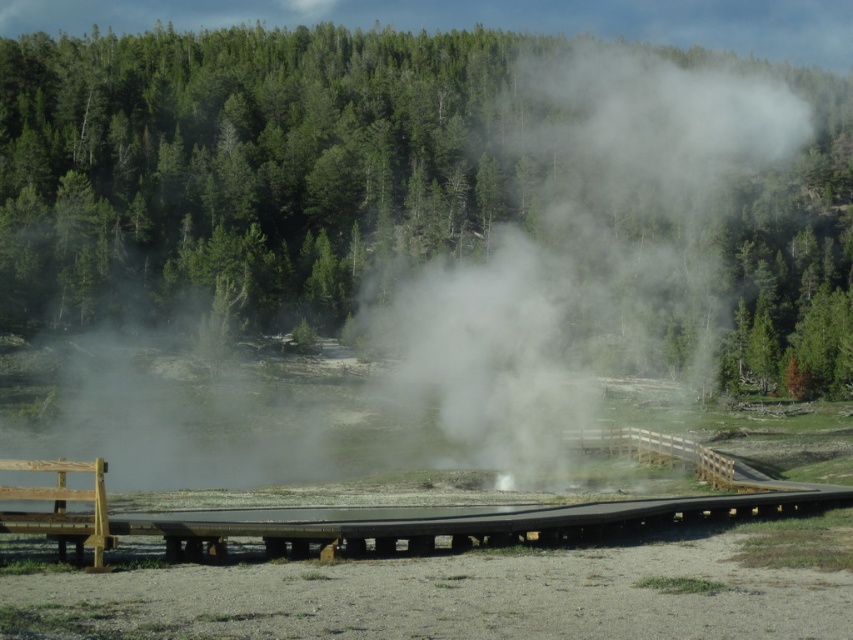
Question: Considering the relative positions of white translucent steam at center and black wood rail at center in the image provided, where is white translucent steam at center located with respect to black wood rail at center?

Choices:
 (A) below
 (B) above

Answer: (B)

Question: Can you confirm if white translucent steam at center is positioned below black wood rail at center?

Choices:
 (A) yes
 (B) no

Answer: (B)

Question: Considering the real-world distances, which object is closest to the black wood rail at center?

Choices:
 (A) white translucent steam at center
 (B) wooden park bench at lower left

Answer: (B)

Question: Does black wood rail at center appear on the left side of wooden park bench at lower left?

Choices:
 (A) no
 (B) yes

Answer: (A)

Question: Which point appears farthest from the camera in this image?

Choices:
 (A) (535, 529)
 (B) (619, 170)

Answer: (B)

Question: Which of the following is the closest to the observer?

Choices:
 (A) white translucent steam at center
 (B) black wood rail at center
 (C) wooden park bench at lower left

Answer: (C)